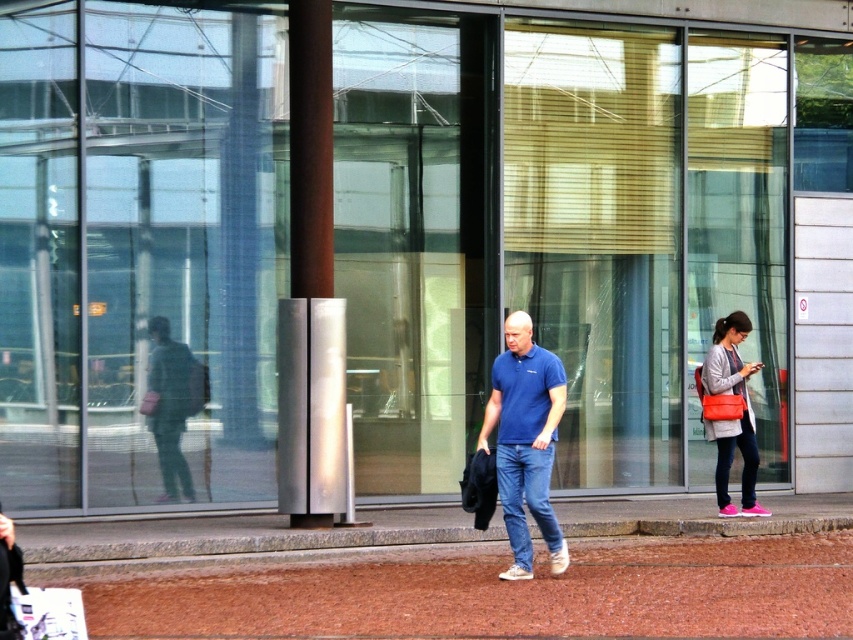
Question: Which point is closer to the camera?

Choices:
 (A) brown gravel at center
 (B) blue cotton polo shirt at center
 (C) green fabric jacket at left

Answer: (A)

Question: Can you confirm if brown gravel at center is bigger than silver metallic pole at center?

Choices:
 (A) no
 (B) yes

Answer: (B)

Question: Can you confirm if blue cotton polo shirt at center is positioned below silver metallic pole at center?

Choices:
 (A) yes
 (B) no

Answer: (A)

Question: Is brown gravel at center wider than green fabric jacket at left?

Choices:
 (A) yes
 (B) no

Answer: (A)

Question: Which of the following is the closest to the observer?

Choices:
 (A) brown gravel at center
 (B) green fabric jacket at left
 (C) matte pink sneakers at right
 (D) blue cotton polo shirt at center

Answer: (A)

Question: Among these objects, which one is farthest from the camera?

Choices:
 (A) brown gravel at center
 (B) green fabric jacket at left

Answer: (B)